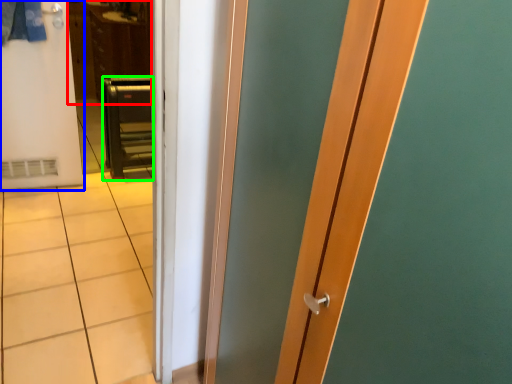
Question: Based on their relative distances, which object is nearer to dresser (highlighted by a red box)? Choose from door (highlighted by a blue box) and furniture (highlighted by a green box).

Choices:
 (A) door
 (B) furniture

Answer: (B)